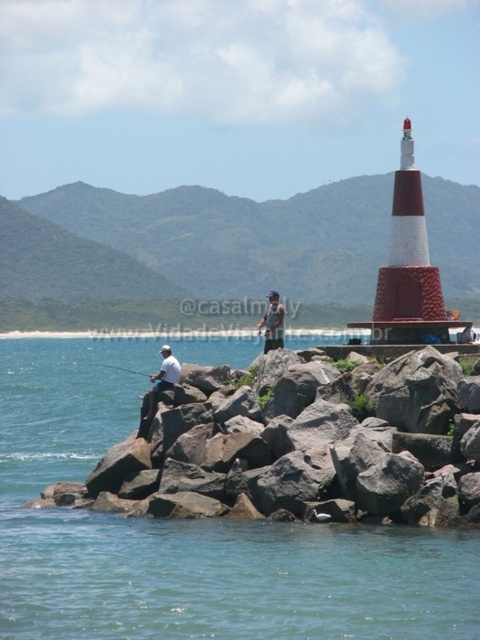
Question: Which point appears closest to the camera in this image?

Choices:
 (A) (252, 632)
 (B) (282, 310)
 (C) (169, 368)

Answer: (A)

Question: In this image, where is white matte shirt at left located relative to white fabric shirt at center?

Choices:
 (A) below
 (B) above

Answer: (A)

Question: Does transparent blue water at center appear over white matte shirt at left?

Choices:
 (A) no
 (B) yes

Answer: (A)

Question: Which object is the closest to the white fabric shirt at center?

Choices:
 (A) white matte shirt at left
 (B) transparent blue water at center

Answer: (A)

Question: Which point is farther to the camera?

Choices:
 (A) (164, 368)
 (B) (283, 333)
 (C) (247, 582)

Answer: (B)

Question: Does white matte shirt at left appear on the left side of white fabric shirt at center?

Choices:
 (A) no
 (B) yes

Answer: (B)